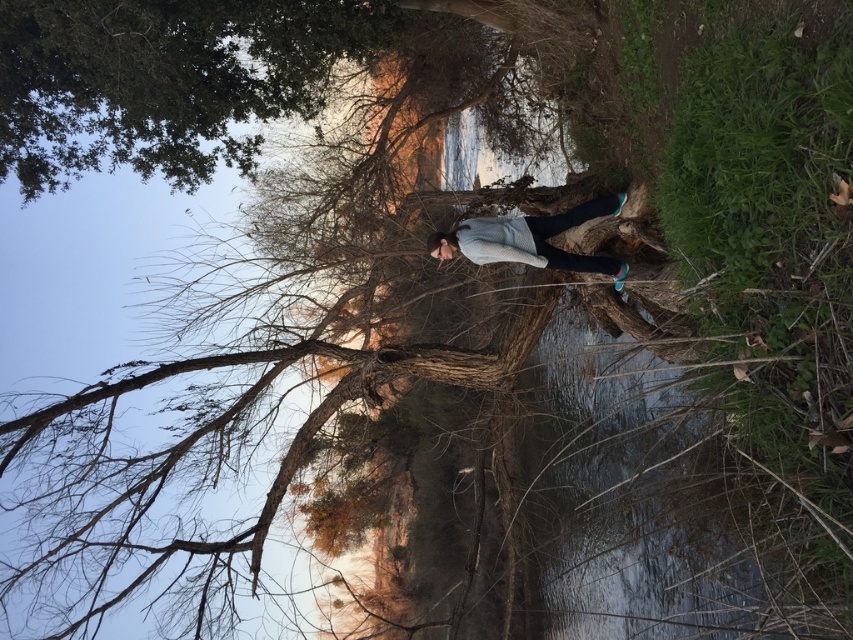
Is green leafy tree at upper left bigger than white sweater at center?

Indeed, green leafy tree at upper left has a larger size compared to white sweater at center.

Who is positioned more to the right, green leafy tree at upper left or white sweater at center?

Positioned to the right is white sweater at center.

At what (x,y) coordinates should I click in order to perform the action: click on green leafy tree at upper left. Please return your answer as a coordinate pair (x, y). The height and width of the screenshot is (640, 853). Looking at the image, I should click on (164, 80).

Identify the location of green leafy tree at upper left. (164, 80).